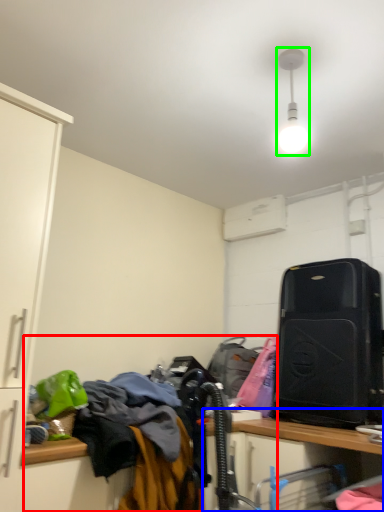
Question: Estimate the real-world distances between objects in this image. Which object is farther from laundry (highlighted by a red box), computer desk (highlighted by a blue box) or light fixture (highlighted by a green box)?

Choices:
 (A) computer desk
 (B) light fixture

Answer: (B)